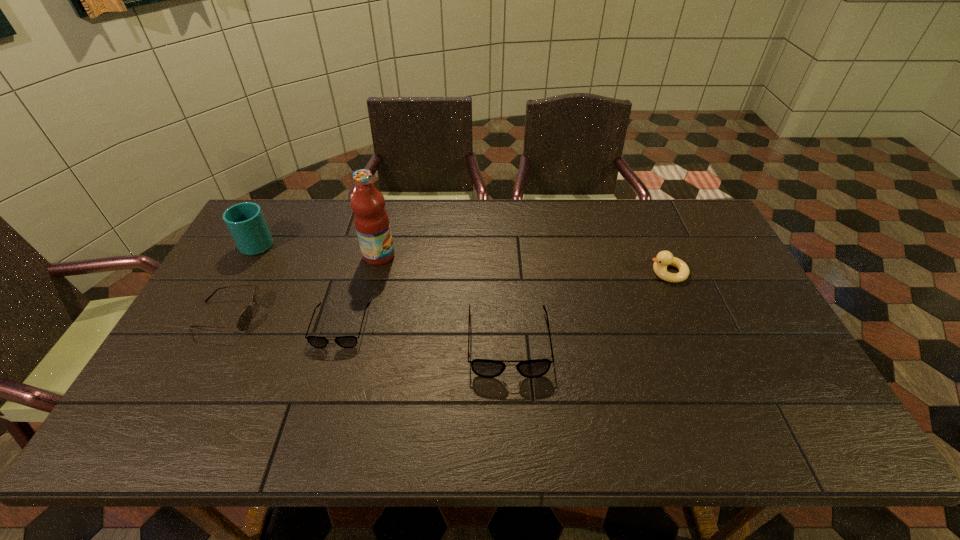
Please point a spot to add another spectacles on the right. Please provide its 2D coordinates. Your answer should be formatted as a tuple, i.e. [(x, y)], where the tuple contains the x and y coordinates of a point satisfying the conditions above.

[(687, 359)]